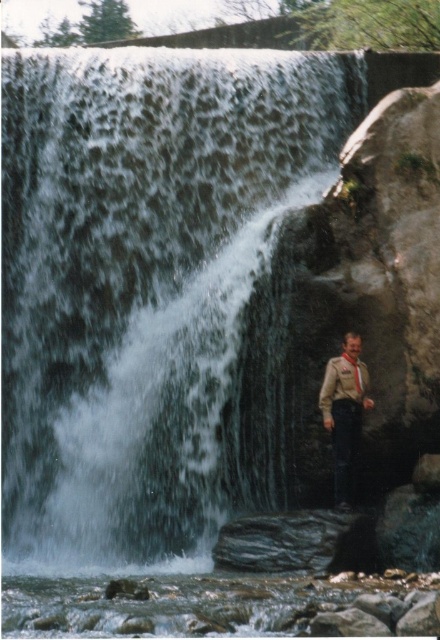
Is the position of clear water at center less distant than that of matte brown tie at right?

No.

Between point (204, 320) and point (356, 374), which one is positioned in front?

Point (356, 374) is in front.

Does point (149, 531) come in front of point (355, 371)?

No.

Locate an element on the screen. This screenshot has width=440, height=640. clear water at center is located at coordinates (150, 288).

Consider the image. Does brown leather jacket at lower right have a greater height compared to matte brown tie at right?

Yes, brown leather jacket at lower right is taller than matte brown tie at right.

How distant is brown leather jacket at lower right from matte brown tie at right?

They are 4.14 feet apart.

Who is more distant from viewer, (341, 397) or (356, 380)?

The point (356, 380) is behind.

This screenshot has width=440, height=640. I want to click on brown leather jacket at lower right, so click(344, 413).

Which is behind, point (271, 321) or point (355, 412)?

The point (271, 321) is more distant.

Consider the image. Is clear water at center further to the viewer compared to brown leather jacket at lower right?

Yes, it is behind brown leather jacket at lower right.

Which is behind, point (40, 467) or point (333, 380)?

The point (40, 467) is behind.

Identify the location of clear water at center. This screenshot has height=640, width=440. (150, 288).